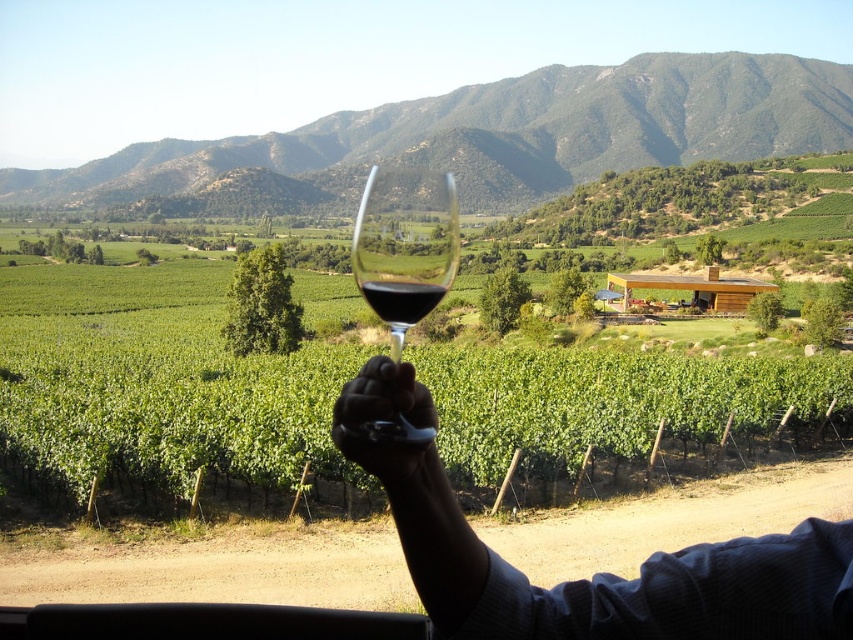
Does green textured hillside at upper center appear over translucent glass at center?

Indeed, green textured hillside at upper center is positioned over translucent glass at center.

Between point (177, 172) and point (364, 300), which one is positioned behind?

Point (177, 172)

Locate an element on the screen. green textured hillside at upper center is located at coordinates (512, 131).

Between point (641, 625) and point (347, 442), which one is positioned behind?

The point (641, 625) is more distant.

In order to click on silvery metallic knife at center in this screenshot , I will do `click(595, 573)`.

Is green textured hillside at upper center thinner than black rubber glove at center?

Incorrect, green textured hillside at upper center's width is not less than black rubber glove at center's.

This screenshot has height=640, width=853. I want to click on green textured hillside at upper center, so click(x=512, y=131).

Is point (636, 164) more distant than point (339, 394)?

Yes, point (636, 164) is behind point (339, 394).

You are a GUI agent. You are given a task and a screenshot of the screen. Output one action in this format:
    pyautogui.click(x=<x>, y=<y>)
    Task: Click on the green textured hillside at upper center
    The image size is (853, 640).
    Given the screenshot: What is the action you would take?
    pyautogui.click(x=512, y=131)